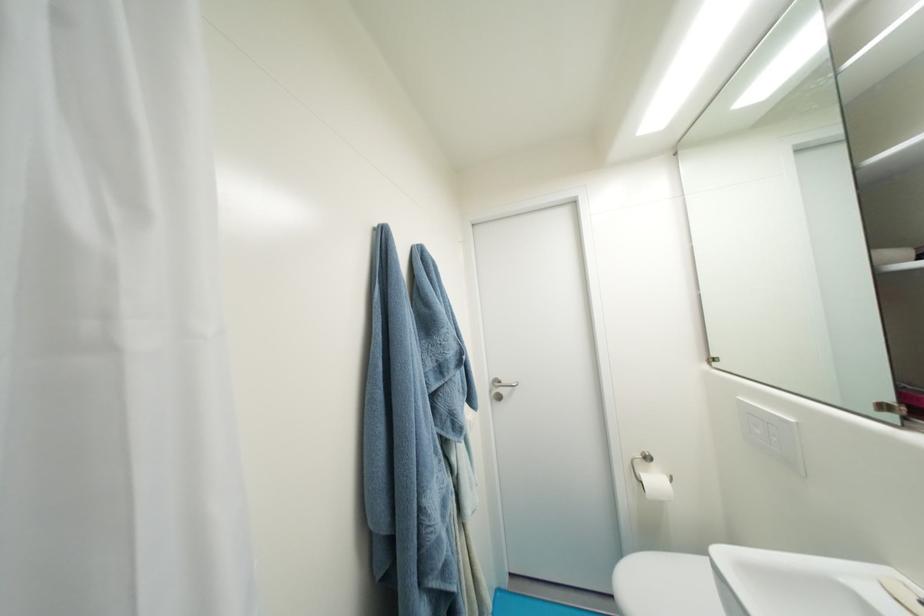
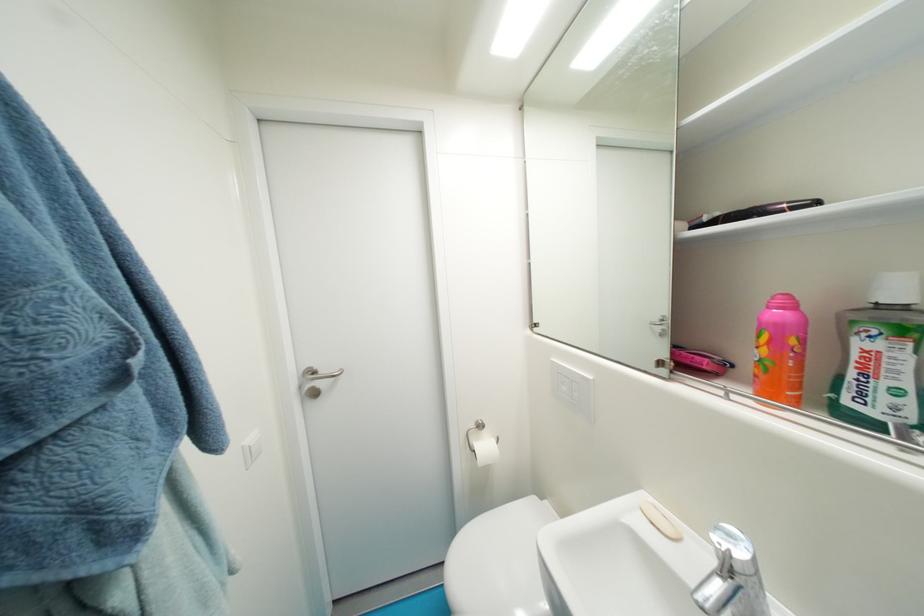
The point at (662, 482) is marked in the first image. Where is the corresponding point in the second image?

(492, 448)